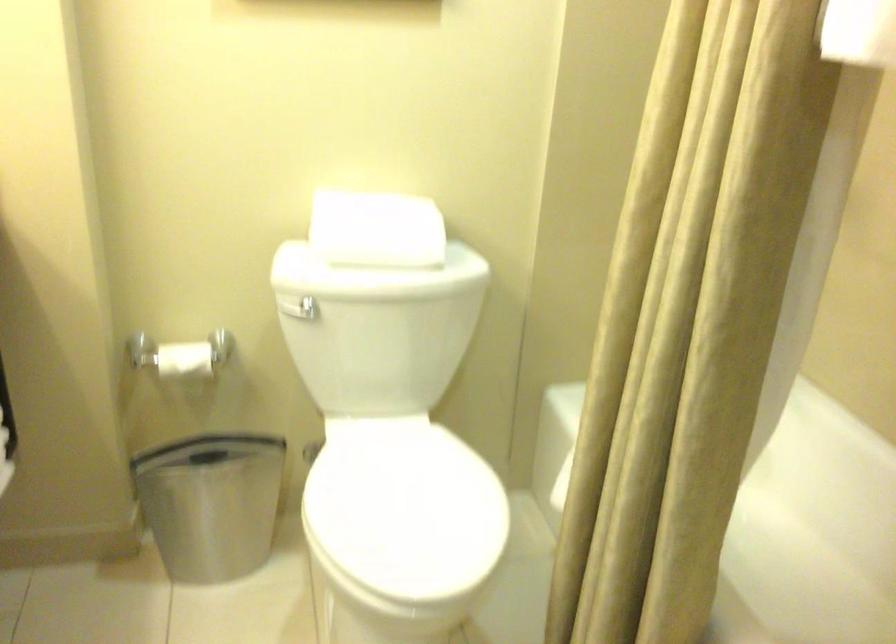
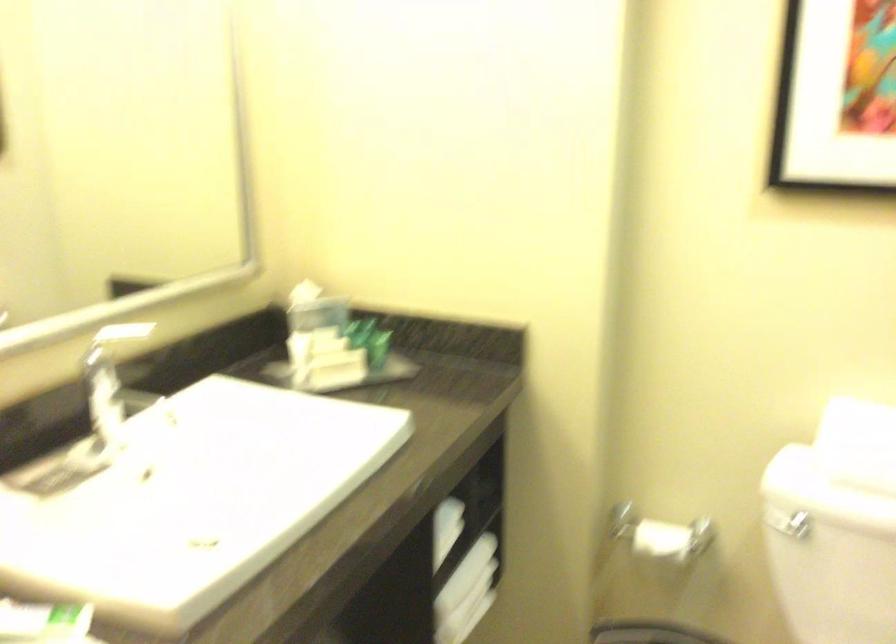
The point at (x=185, y=357) is marked in the first image. Where is the corresponding point in the second image?

(660, 540)